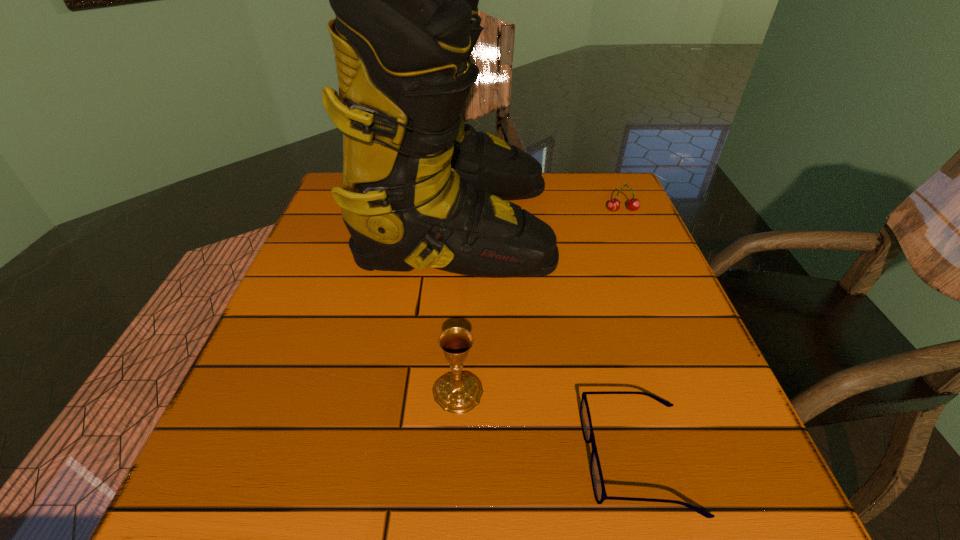
At what (x,y) coordinates should I click in order to perform the action: click on free space located 0.080m on the front-facing side of the shortest object. Please return your answer as a coordinate pair (x, y). This screenshot has width=960, height=540. Looking at the image, I should click on pos(533,458).

The width and height of the screenshot is (960, 540). I want to click on ski boots that is at the far edge, so click(420, 189).

The height and width of the screenshot is (540, 960). Find the location of `cherry situated at the far edge`. cherry situated at the far edge is located at coordinates (633, 204).

Image resolution: width=960 pixels, height=540 pixels. Identify the location of object at the near edge. (x=597, y=479).

Locate an element on the screen. The width and height of the screenshot is (960, 540). object that is positioned at the left edge is located at coordinates (420, 189).

At what (x,y) coordinates should I click in order to perform the action: click on cherry that is positioned at the right edge. Please return your answer as a coordinate pair (x, y). Image resolution: width=960 pixels, height=540 pixels. Looking at the image, I should click on (633, 204).

You are a GUI agent. You are given a task and a screenshot of the screen. Output one action in this format:
    pyautogui.click(x=<x>, y=<y>)
    Task: Click on the spectacles located at the right edge
    This screenshot has height=540, width=960.
    Given the screenshot: What is the action you would take?
    pyautogui.click(x=597, y=479)

The image size is (960, 540). I want to click on object at the far left corner, so click(420, 189).

The width and height of the screenshot is (960, 540). In order to click on object located in the far right corner section of the desktop in this screenshot , I will do `click(633, 204)`.

Identify the location of object that is positioned at the near right corner. The image size is (960, 540). (597, 479).